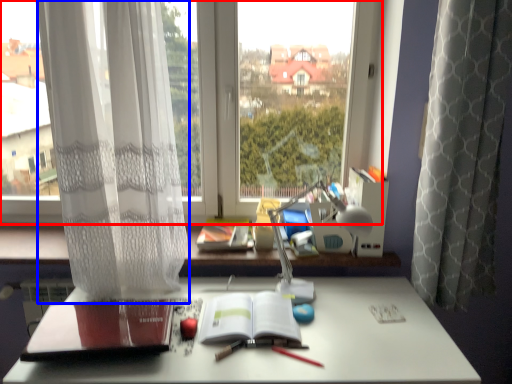
Question: Which object appears closest to the camera in this image, window (highlighted by a red box) or curtain (highlighted by a blue box)?

Choices:
 (A) window
 (B) curtain

Answer: (B)